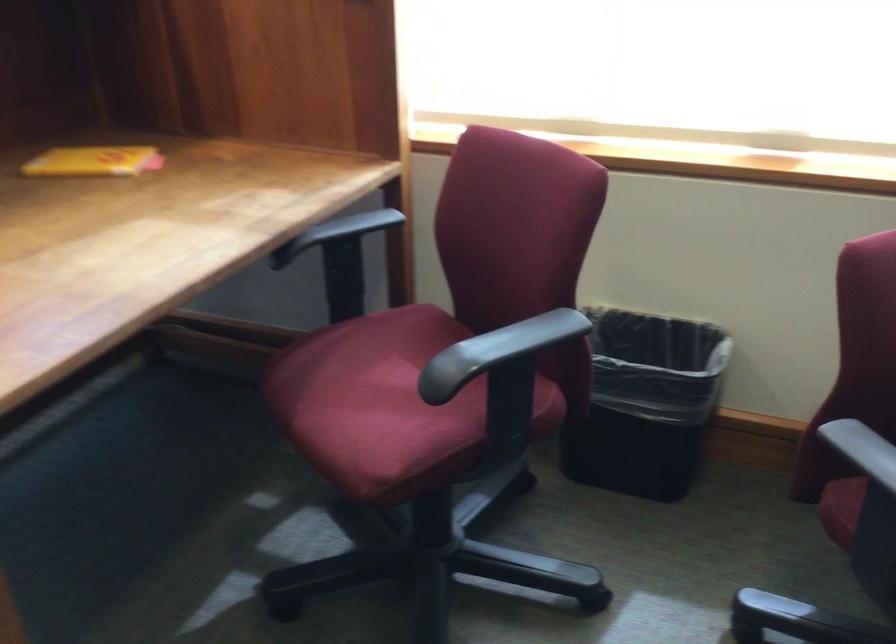
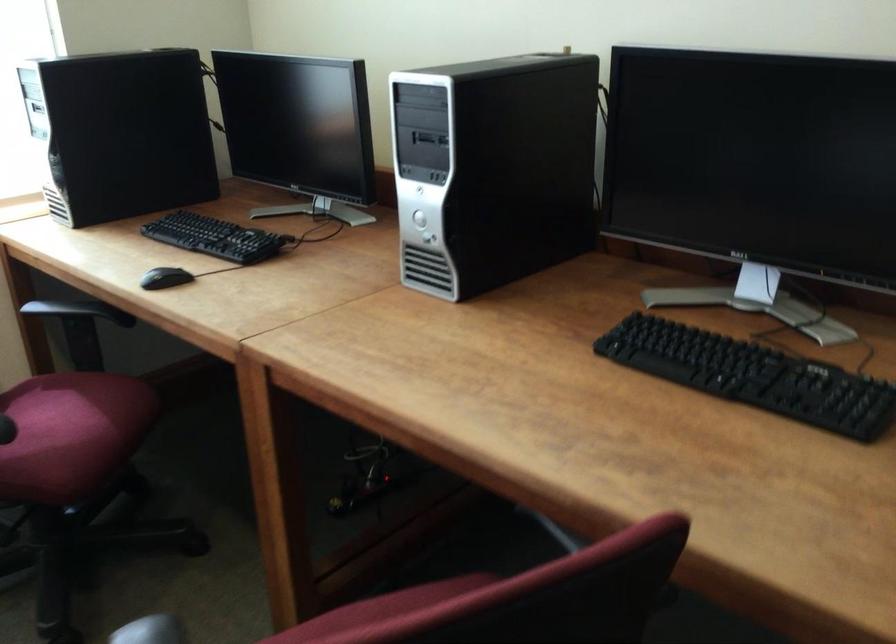
Question: Based on the continuous images, in which direction is the camera rotating? Reply with the corresponding letter.

Choices:
 (A) Left
 (B) Right
 (C) Up
 (D) Down

Answer: (B)